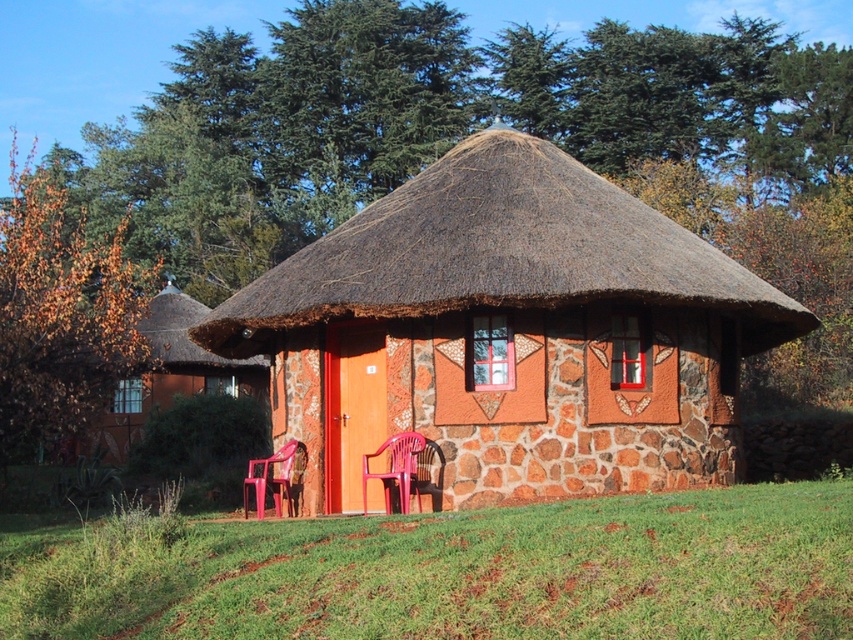
You are standing in front of the traditional house with a thatched roof and want to sit down on the ground. There is green grass at lower center and a translucent plastic chair at lower center. Which surface is shorter and better suited for sitting directly on the ground?

The green grass at lower center is shorter than the translucent plastic chair at lower center, making it better suited for sitting directly on the ground.

You are standing in front of the traditional house with a thatched roof. You notice green grass at lower center and a translucent plastic chair at lower center. Which object takes up more space in the scene?

The green grass at lower center takes up more space in the scene as it is bigger than the translucent plastic chair at lower center.